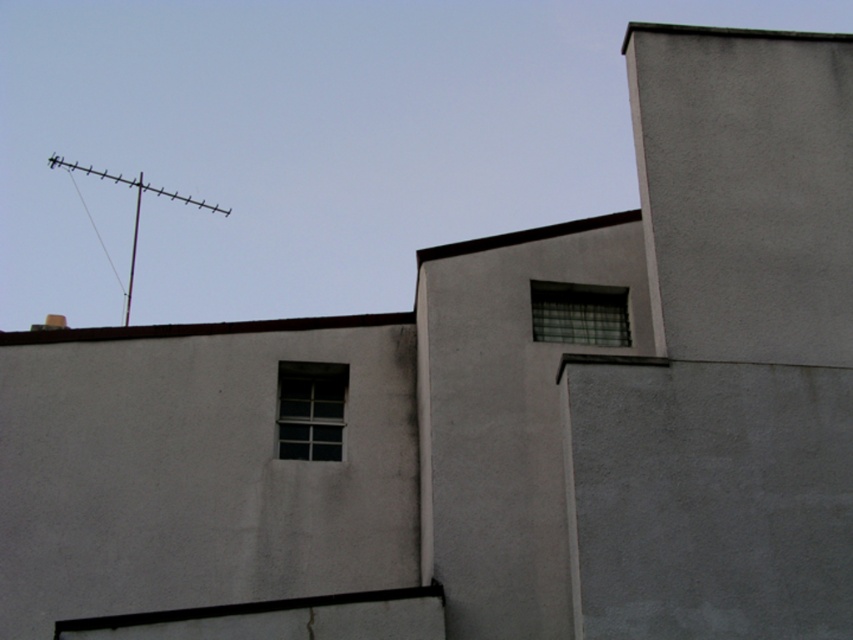
Question: Is clear glass window at center bigger than metallic antenna at upper left?

Choices:
 (A) no
 (B) yes

Answer: (A)

Question: Which is nearer to the clear glass window at upper right?

Choices:
 (A) metallic antenna at upper left
 (B) brown concrete roof at upper center
 (C) clear glass window at center

Answer: (B)

Question: Does clear glass window at center appear under metallic antenna at upper left?

Choices:
 (A) yes
 (B) no

Answer: (A)

Question: Based on their relative distances, which object is farther from the metallic antenna at upper left?

Choices:
 (A) clear glass window at center
 (B) brown concrete roof at upper center
 (C) clear glass window at upper right

Answer: (C)

Question: Does brown concrete roof at upper center have a lesser width compared to metallic antenna at upper left?

Choices:
 (A) yes
 (B) no

Answer: (A)

Question: Which point is closer to the camera taking this photo?

Choices:
 (A) (140, 195)
 (B) (219, 324)
 (C) (329, 401)
 (D) (584, 340)

Answer: (D)